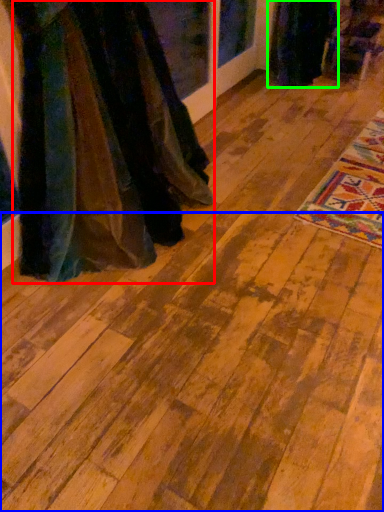
Question: Estimate the real-world distances between objects in this image. Which object is closer to fancy dress (highlighted by a red box), plywood (highlighted by a blue box) or fancy dress (highlighted by a green box)?

Choices:
 (A) plywood
 (B) fancy dress

Answer: (A)